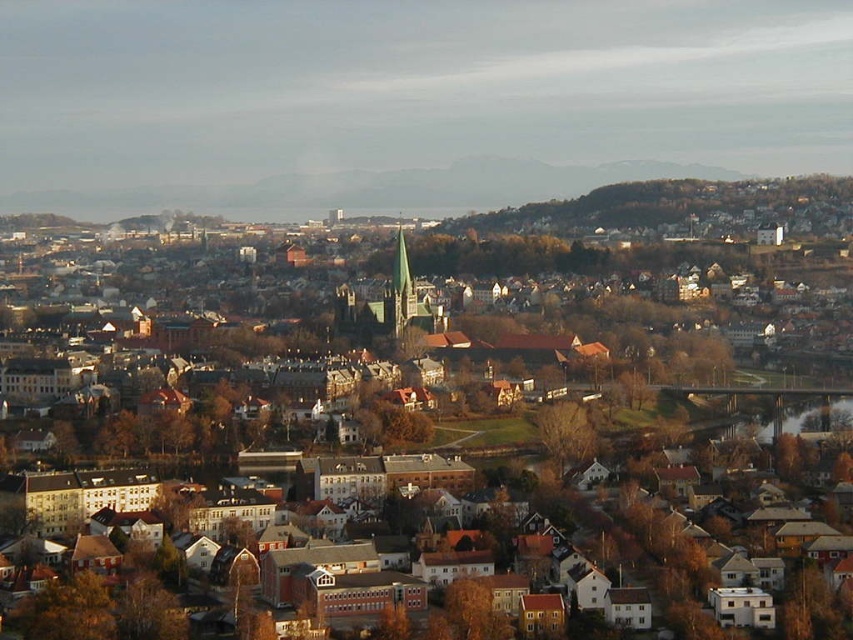
You are a drone operator tasked with capturing aerial footage of the city. Your drone is currently hovering above the brown wooden houses at center and needs to descend to the brown textured tree at lower left. Can you safely descend vertically without moving horizontally? Explain your reasoning based on their positions.

The brown wooden houses at center is located above the brown textured tree at lower left, so descending vertically from the brown wooden houses at center would lead directly to the brown textured tree at lower left. Since there is no horizontal distance between them, the drone can safely descend without moving horizontally.

You are standing in the city and want to take a photo of the brown wooden houses at center and the green stone spire at center. Which object will appear larger in your photo?

The brown wooden houses at center will appear larger in the photo because they are closer to the viewer than the green stone spire at center.